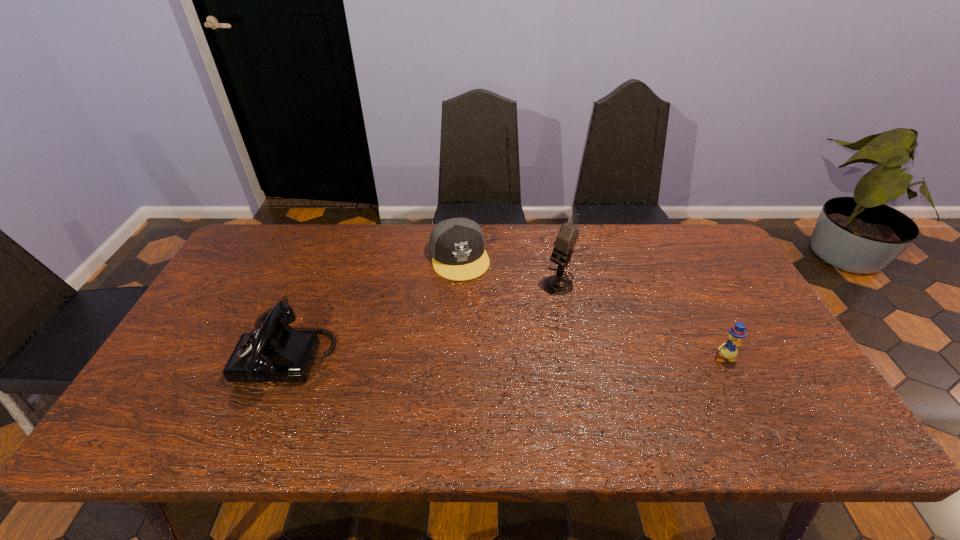
What are the coordinates of `empty space between the third object from right to left and the telephone` in the screenshot? It's located at (374, 305).

I want to click on empty space that is in between the duckling and the tallest object, so click(x=640, y=320).

The width and height of the screenshot is (960, 540). In order to click on vacant space that's between the duckling and the microphone in this screenshot , I will do `click(640, 320)`.

Where is `free spot between the leftmost object and the second object from right to left`? free spot between the leftmost object and the second object from right to left is located at coordinates (423, 317).

Where is `vacant space that is in between the microphone and the second object from left to right`? The width and height of the screenshot is (960, 540). vacant space that is in between the microphone and the second object from left to right is located at coordinates (509, 269).

The width and height of the screenshot is (960, 540). Find the location of `free space between the rightmost object and the microphone`. free space between the rightmost object and the microphone is located at coordinates (640, 320).

Select which object appears as the third closest to the microphone. Please provide its 2D coordinates. Your answer should be formatted as a tuple, i.e. [(x, y)], where the tuple contains the x and y coordinates of a point satisfying the conditions above.

[(275, 352)]

Identify which object is the nearest to the third object from left to right. Please provide its 2D coordinates. Your answer should be formatted as a tuple, i.e. [(x, y)], where the tuple contains the x and y coordinates of a point satisfying the conditions above.

[(457, 246)]

Locate an element on the screen. vacant point that satisfies the following two spatial constraints: 1. on the front side of the tallest object; 2. on the left side of the third object from right to left is located at coordinates (458, 282).

The width and height of the screenshot is (960, 540). In order to click on free point that satisfies the following two spatial constraints: 1. on the front side of the third object from right to left; 2. on the right side of the third object from left to right in this screenshot , I will do `click(458, 282)`.